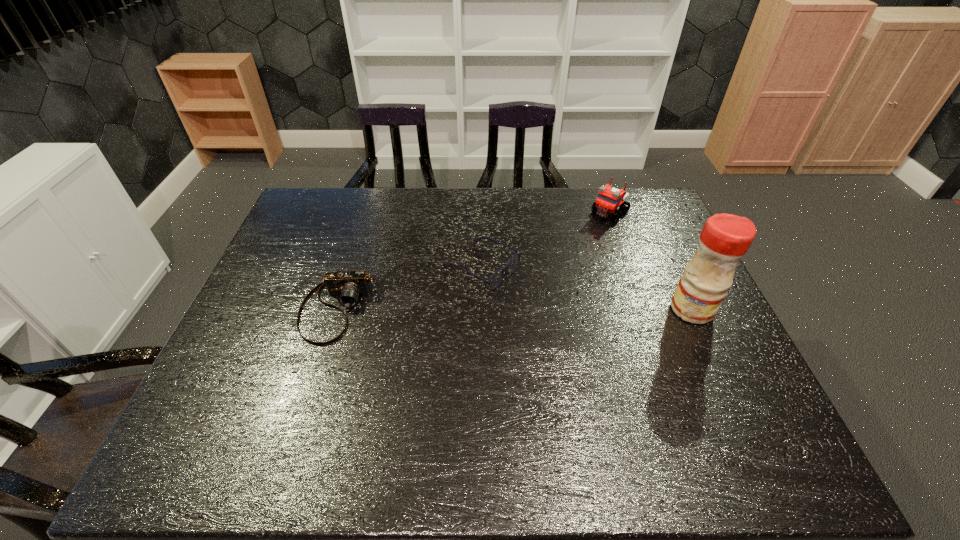
In the image, there is a desktop. At what (x,y) coordinates should I click in order to perform the action: click on blank space at the far edge. Please return your answer as a coordinate pair (x, y). Image resolution: width=960 pixels, height=540 pixels. Looking at the image, I should click on (478, 216).

In the image, there is a desktop. Identify the location of vacant space at the near edge. This screenshot has width=960, height=540. (401, 383).

At what (x,y) coordinates should I click in order to perform the action: click on free location at the left edge of the desktop. Please return your answer as a coordinate pair (x, y). This screenshot has width=960, height=540. Looking at the image, I should click on (316, 259).

The width and height of the screenshot is (960, 540). In order to click on vacant space at the right edge of the desktop in this screenshot , I will do `click(626, 232)`.

The width and height of the screenshot is (960, 540). In the image, there is a desktop. Identify the location of free space at the far left corner. (340, 194).

This screenshot has height=540, width=960. Find the location of `vacant space at the far right corner of the desktop`. vacant space at the far right corner of the desktop is located at coordinates (650, 197).

The image size is (960, 540). Identify the location of free space between the spectacles and the camera. (409, 288).

Where is `unoccupied position between the farthest object and the third object from right to left`? unoccupied position between the farthest object and the third object from right to left is located at coordinates (545, 239).

This screenshot has height=540, width=960. In order to click on vacant space in between the shortest object and the leftmost object in this screenshot , I will do `click(409, 288)`.

I want to click on vacant region between the second object from left to right and the rightmost object, so click(x=587, y=288).